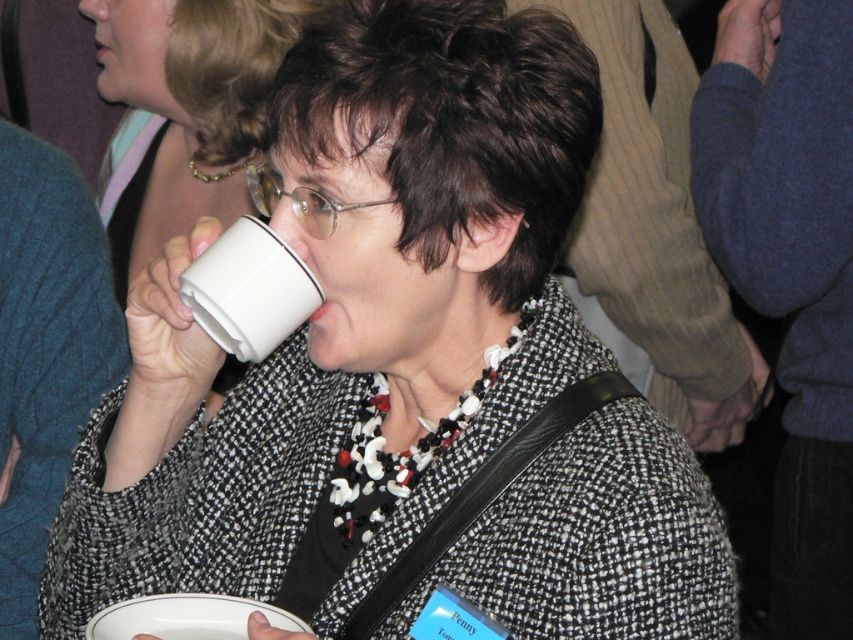
Can you confirm if white matte cup at upper center is thinner than white ceramic mug at upper center?

No.

Measure the distance between point (202, 70) and camera.

Point (202, 70) is 1.59 meters away from camera.

What are the coordinates of `white matte cup at upper center` in the screenshot? It's located at (189, 108).